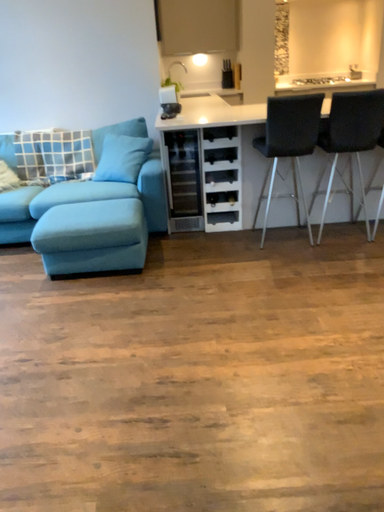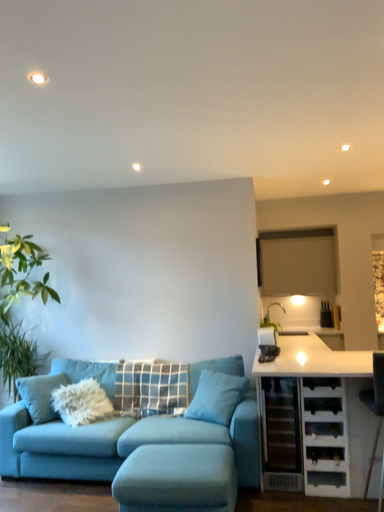
Question: How did the camera likely rotate when shooting the video?

Choices:
 (A) rotated upward
 (B) rotated downward

Answer: (A)